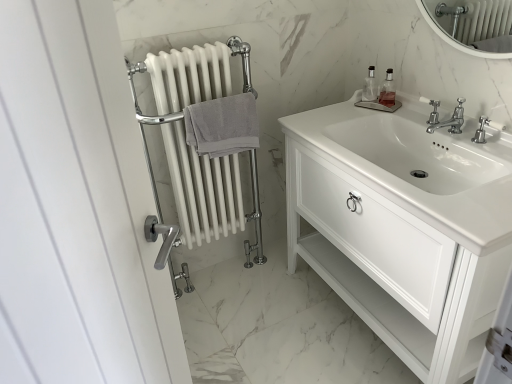
Locate an element on the screen. clear glass soap dispenser at upper right, placed as the 1th soap dispenser when sorted from left to right is located at coordinates (370, 86).

The image size is (512, 384). What do you see at coordinates (404, 226) in the screenshot?
I see `white glossy cabinet at center` at bounding box center [404, 226].

This screenshot has height=384, width=512. What do you see at coordinates (388, 90) in the screenshot? I see `clear glass soap dispenser at upper right, which ranks as the first soap dispenser in right-to-left order` at bounding box center [388, 90].

This screenshot has height=384, width=512. What are the coordinates of `gray cotton towel at center-left` in the screenshot? It's located at (222, 125).

Find the location of a particular element. clear glass soap dispenser at upper right, placed as the second soap dispenser when sorted from right to left is located at coordinates (370, 86).

Between white glossy cabinet at center and polished chrome faucet at center, which one has smaller size?

With smaller size is polished chrome faucet at center.

Considering the positions of objects white glossy cabinet at center and polished chrome faucet at center in the image provided, who is more to the right, white glossy cabinet at center or polished chrome faucet at center?

polished chrome faucet at center.

Would you consider white glossy cabinet at center to be distant from polished chrome faucet at center?

No, white glossy cabinet at center is not far from polished chrome faucet at center.

Can you confirm if clear glass soap dispenser at upper right, arranged as the 2th soap dispenser when viewed from the left, is wider than gray cotton towel at center-left?

In fact, clear glass soap dispenser at upper right, arranged as the 2th soap dispenser when viewed from the left, might be narrower than gray cotton towel at center-left.

Is there a large distance between clear glass soap dispenser at upper right, which ranks as the first soap dispenser in right-to-left order, and gray cotton towel at center-left?

No, there isn't a large distance between clear glass soap dispenser at upper right, which ranks as the first soap dispenser in right-to-left order, and gray cotton towel at center-left.

In the scene shown: Would you say clear glass soap dispenser at upper right, which ranks as the first soap dispenser in right-to-left order, is inside or outside gray cotton towel at center-left?

clear glass soap dispenser at upper right, which ranks as the first soap dispenser in right-to-left order, exists outside the volume of gray cotton towel at center-left.

From the image's perspective, which object appears higher, clear glass soap dispenser at upper right, arranged as the 2th soap dispenser when viewed from the left, or gray cotton towel at center-left?

clear glass soap dispenser at upper right, arranged as the 2th soap dispenser when viewed from the left, appears higher in the image.

Where is `bathroom cabinet in front of the clear glass soap dispenser at upper right, placed as the 1th soap dispenser when sorted from left to right`? The width and height of the screenshot is (512, 384). bathroom cabinet in front of the clear glass soap dispenser at upper right, placed as the 1th soap dispenser when sorted from left to right is located at coordinates (404, 226).

Between clear glass soap dispenser at upper right, placed as the 1th soap dispenser when sorted from left to right, and white glossy cabinet at center, which one appears on the right side from the viewer's perspective?

white glossy cabinet at center is more to the right.

From a real-world perspective, is clear glass soap dispenser at upper right, placed as the second soap dispenser when sorted from right to left, located higher than white glossy cabinet at center?

Yes, from a real-world perspective, clear glass soap dispenser at upper right, placed as the second soap dispenser when sorted from right to left, is on top of white glossy cabinet at center.

Is clear glass soap dispenser at upper right, placed as the second soap dispenser when sorted from right to left, oriented away from white glossy cabinet at center?

That's not correct — clear glass soap dispenser at upper right, placed as the second soap dispenser when sorted from right to left, is not looking away from white glossy cabinet at center.

Considering the sizes of clear glass soap dispenser at upper right, placed as the 1th soap dispenser when sorted from left to right, and gray cotton towel at center-left in the image, is clear glass soap dispenser at upper right, placed as the 1th soap dispenser when sorted from left to right, taller or shorter than gray cotton towel at center-left?

Clearly, clear glass soap dispenser at upper right, placed as the 1th soap dispenser when sorted from left to right, is shorter compared to gray cotton towel at center-left.

This screenshot has width=512, height=384. I want to click on the 1st soap dispenser counting from the right side of the gray cotton towel at center-left, so click(x=370, y=86).

Are clear glass soap dispenser at upper right, placed as the 1th soap dispenser when sorted from left to right, and gray cotton towel at center-left far apart?

No, clear glass soap dispenser at upper right, placed as the 1th soap dispenser when sorted from left to right, is not far away from gray cotton towel at center-left.

Considering the sizes of clear glass soap dispenser at upper right, arranged as the 2th soap dispenser when viewed from the left, and polished chrome faucet at center in the image, is clear glass soap dispenser at upper right, arranged as the 2th soap dispenser when viewed from the left, taller or shorter than polished chrome faucet at center?

In the image, clear glass soap dispenser at upper right, arranged as the 2th soap dispenser when viewed from the left, appears to be taller than polished chrome faucet at center.

Is clear glass soap dispenser at upper right, arranged as the 2th soap dispenser when viewed from the left, turned away from polished chrome faucet at center?

clear glass soap dispenser at upper right, arranged as the 2th soap dispenser when viewed from the left, is not turned away from polished chrome faucet at center.

Looking at this image, which is behind, clear glass soap dispenser at upper right, arranged as the 2th soap dispenser when viewed from the left, or polished chrome faucet at center?

clear glass soap dispenser at upper right, arranged as the 2th soap dispenser when viewed from the left, is further from the camera.

Does clear glass soap dispenser at upper right, which ranks as the first soap dispenser in right-to-left order, touch polished chrome faucet at center?

No.

In the image, there is a clear glass soap dispenser at upper right, placed as the 1th soap dispenser when sorted from left to right. Where is `tap below it (from a real-world perspective)`? The image size is (512, 384). tap below it (from a real-world perspective) is located at coordinates (449, 120).

Who is more distant, clear glass soap dispenser at upper right, placed as the 1th soap dispenser when sorted from left to right, or polished chrome faucet at center?

Positioned behind is clear glass soap dispenser at upper right, placed as the 1th soap dispenser when sorted from left to right.

Is clear glass soap dispenser at upper right, placed as the second soap dispenser when sorted from right to left, located outside polished chrome faucet at center?

Indeed, clear glass soap dispenser at upper right, placed as the second soap dispenser when sorted from right to left, is completely outside polished chrome faucet at center.

In terms of width, does clear glass soap dispenser at upper right, placed as the 1th soap dispenser when sorted from left to right, look wider or thinner when compared to polished chrome faucet at center?

clear glass soap dispenser at upper right, placed as the 1th soap dispenser when sorted from left to right, is thinner than polished chrome faucet at center.

Is polished chrome faucet at center thinner than white glossy cabinet at center?

Correct, the width of polished chrome faucet at center is less than that of white glossy cabinet at center.

Is white glossy cabinet at center at the back of polished chrome faucet at center?

No.

Is polished chrome faucet at center not near white glossy cabinet at center?

That's not correct — polished chrome faucet at center is a little close to white glossy cabinet at center.

Does polished chrome faucet at center have a larger size compared to white glossy cabinet at center?

No, polished chrome faucet at center is not bigger than white glossy cabinet at center.

The height and width of the screenshot is (384, 512). Identify the location of bathroom cabinet that appears in front of the polished chrome faucet at center. tap(404, 226).

This screenshot has height=384, width=512. Identify the location of soap dispenser that is the 1st one when counting upward from the gray cotton towel at center-left (from the image's perspective). (388, 90).

Looking at the image, which one is located closer to gray cotton towel at center-left, polished chrome faucet at center or clear glass soap dispenser at upper right, placed as the second soap dispenser when sorted from right to left?

Among the two, clear glass soap dispenser at upper right, placed as the second soap dispenser when sorted from right to left, is located nearer to gray cotton towel at center-left.

Which object lies further to the anchor point polished chrome faucet at center, clear glass soap dispenser at upper right, which ranks as the first soap dispenser in right-to-left order, or clear glass soap dispenser at upper right, placed as the second soap dispenser when sorted from right to left?

clear glass soap dispenser at upper right, placed as the second soap dispenser when sorted from right to left, lies further to polished chrome faucet at center than the other object.

Which object lies nearer to the anchor point white glossy cabinet at center, polished chrome faucet at center or clear glass soap dispenser at upper right, arranged as the 2th soap dispenser when viewed from the left?

The object closer to white glossy cabinet at center is polished chrome faucet at center.

Based on their spatial positions, is clear glass soap dispenser at upper right, which ranks as the first soap dispenser in right-to-left order, or gray cotton towel at center-left further from clear glass soap dispenser at upper right, placed as the second soap dispenser when sorted from right to left?

gray cotton towel at center-left is positioned further to the anchor clear glass soap dispenser at upper right, placed as the second soap dispenser when sorted from right to left.

Considering their positions, is polished chrome faucet at center positioned further to clear glass soap dispenser at upper right, placed as the 1th soap dispenser when sorted from left to right, than white glossy cabinet at center?

white glossy cabinet at center.

When comparing their distances from gray cotton towel at center-left, does white glossy cabinet at center or clear glass soap dispenser at upper right, placed as the second soap dispenser when sorted from right to left, seem closer?

The object closer to gray cotton towel at center-left is white glossy cabinet at center.

Looking at the image, which one is located closer to clear glass soap dispenser at upper right, placed as the second soap dispenser when sorted from right to left, gray cotton towel at center-left or polished chrome faucet at center?

polished chrome faucet at center is positioned closer to the anchor clear glass soap dispenser at upper right, placed as the second soap dispenser when sorted from right to left.

When comparing their distances from polished chrome faucet at center, does clear glass soap dispenser at upper right, arranged as the 2th soap dispenser when viewed from the left, or gray cotton towel at center-left seem closer?

Based on the image, clear glass soap dispenser at upper right, arranged as the 2th soap dispenser when viewed from the left, appears to be nearer to polished chrome faucet at center.

Locate an element on the screen. bath towel between white glossy cabinet at center and clear glass soap dispenser at upper right, placed as the second soap dispenser when sorted from right to left, in the front-back direction is located at coordinates click(x=222, y=125).

The image size is (512, 384). I want to click on tap between white glossy cabinet at center and clear glass soap dispenser at upper right, which ranks as the first soap dispenser in right-to-left order, along the z-axis, so click(x=449, y=120).

Where is `bathroom cabinet located between gray cotton towel at center-left and polished chrome faucet at center in the left-right direction`? The height and width of the screenshot is (384, 512). bathroom cabinet located between gray cotton towel at center-left and polished chrome faucet at center in the left-right direction is located at coordinates (404, 226).

Identify the location of tap located between white glossy cabinet at center and clear glass soap dispenser at upper right, placed as the second soap dispenser when sorted from right to left, in the depth direction. (449, 120).